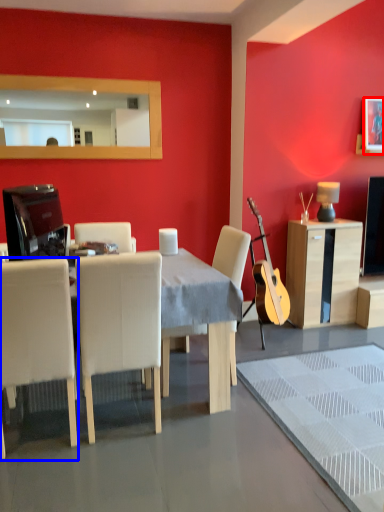
Question: Among these objects, which one is farthest to the camera, picture frame (highlighted by a red box) or chair (highlighted by a blue box)?

Choices:
 (A) picture frame
 (B) chair

Answer: (A)